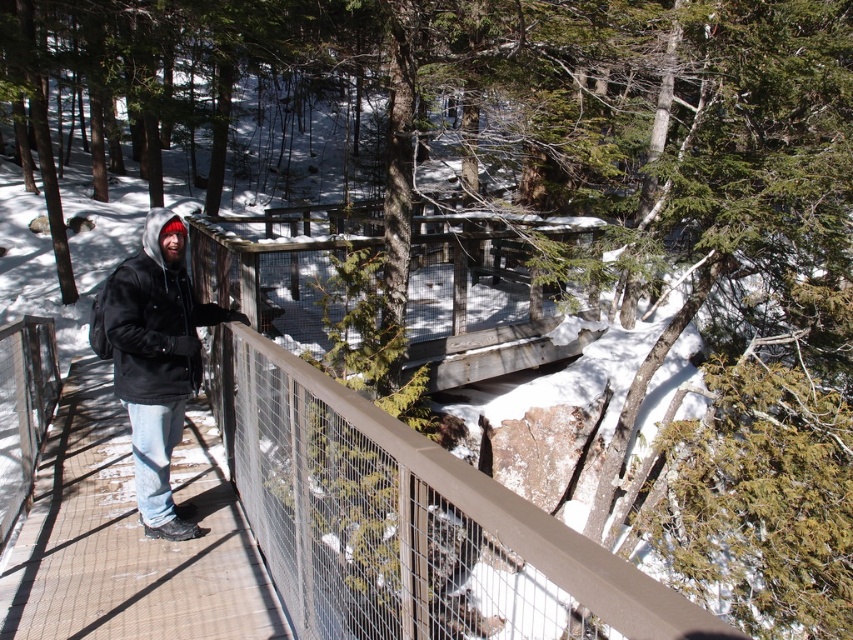
Question: Which point appears closest to the camera in this image?

Choices:
 (A) (425, 266)
 (B) (148, 332)

Answer: (B)

Question: Does wooden planks at center have a smaller size compared to black matte jacket at left?

Choices:
 (A) yes
 (B) no

Answer: (A)

Question: Which point is closer to the camera taking this photo?

Choices:
 (A) click(x=131, y=378)
 (B) click(x=428, y=380)

Answer: (A)

Question: Is the position of wooden planks at center less distant than that of black matte jacket at left?

Choices:
 (A) no
 (B) yes

Answer: (A)

Question: Does wooden planks at center lie in front of black matte jacket at left?

Choices:
 (A) no
 (B) yes

Answer: (A)